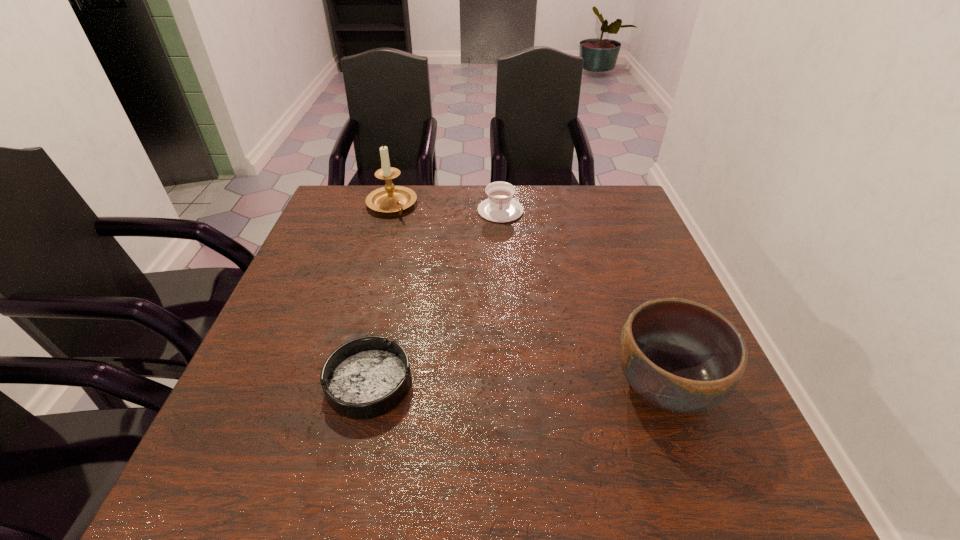
The width and height of the screenshot is (960, 540). Identify the location of free space between the bowl and the shortest object. (517, 384).

Identify the location of free space between the third object from left to right and the ashtray. (435, 297).

I want to click on free spot between the second object from right to left and the rightmost object, so click(x=583, y=298).

I want to click on free area in between the shortest object and the second shortest object, so click(435, 297).

Find the location of a particular element. The height and width of the screenshot is (540, 960). blank region between the shortest object and the rightmost object is located at coordinates (517, 384).

Identify the location of free space between the ashtray and the candle holder. This screenshot has width=960, height=540. click(x=380, y=294).

This screenshot has height=540, width=960. What are the coordinates of `empty space between the ashtray and the tallest object` in the screenshot? It's located at (380, 294).

Locate an element on the screen. free space between the third shortest object and the candle holder is located at coordinates (528, 295).

Locate which object is the closest to the ashtray. Please provide its 2D coordinates. Your answer should be formatted as a tuple, i.e. [(x, y)], where the tuple contains the x and y coordinates of a point satisfying the conditions above.

[(681, 356)]

Find the location of `the second closest object relative to the second object from right to left`. the second closest object relative to the second object from right to left is located at coordinates (681, 356).